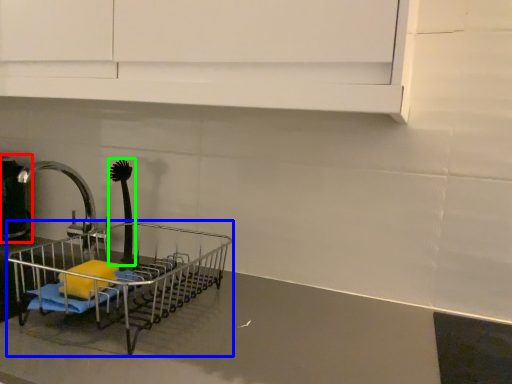
Question: Which is nearer to the appliance (highlighted by a red box)? shopping cart (highlighted by a blue box) or brush (highlighted by a green box).

Choices:
 (A) shopping cart
 (B) brush

Answer: (B)